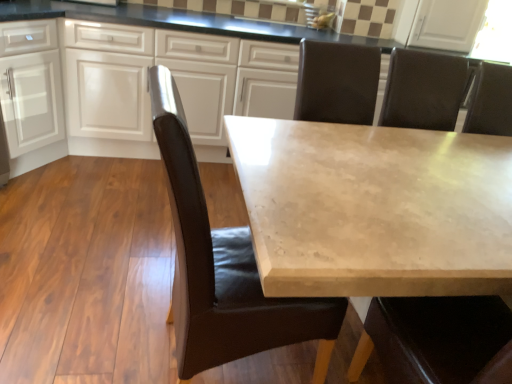
Question: From the image's perspective, is white matte cabinet at left, arranged as the 2th cabinetry when viewed from the right, on top of brown leather chair at center?

Choices:
 (A) no
 (B) yes

Answer: (B)

Question: Is white matte cabinet at left, the 1th cabinetry viewed from the left, further to the viewer compared to brown leather chair at center?

Choices:
 (A) yes
 (B) no

Answer: (A)

Question: Does white matte cabinet at left, arranged as the 2th cabinetry when viewed from the right, have a greater height compared to brown leather chair at center?

Choices:
 (A) no
 (B) yes

Answer: (A)

Question: From the image's perspective, is white matte cabinet at left, arranged as the 2th cabinetry when viewed from the right, located beneath brown leather chair at center?

Choices:
 (A) no
 (B) yes

Answer: (A)

Question: From a real-world perspective, is white matte cabinet at left, arranged as the 2th cabinetry when viewed from the right, physically above brown leather chair at center?

Choices:
 (A) yes
 (B) no

Answer: (B)

Question: Can you confirm if white matte cabinet at left, the 1th cabinetry viewed from the left, is positioned to the left of brown leather chair at center?

Choices:
 (A) yes
 (B) no

Answer: (A)

Question: From a real-world perspective, is white matte cabinet at left, the 1th cabinetry viewed from the left, positioned over beige marble table at center based on gravity?

Choices:
 (A) yes
 (B) no

Answer: (A)

Question: Is white matte cabinet at left, arranged as the 2th cabinetry when viewed from the right, facing towards beige marble table at center?

Choices:
 (A) no
 (B) yes

Answer: (B)

Question: Is the position of white matte cabinet at left, the 1th cabinetry viewed from the left, more distant than that of beige marble table at center?

Choices:
 (A) no
 (B) yes

Answer: (B)

Question: From a real-world perspective, is white matte cabinet at left, the 1th cabinetry viewed from the left, under beige marble table at center?

Choices:
 (A) yes
 (B) no

Answer: (B)

Question: Is the depth of white matte cabinet at left, the 1th cabinetry viewed from the left, less than that of beige marble table at center?

Choices:
 (A) no
 (B) yes

Answer: (A)

Question: Can you confirm if white matte cabinet at left, the 1th cabinetry viewed from the left, is shorter than beige marble table at center?

Choices:
 (A) no
 (B) yes

Answer: (A)

Question: From a real-world perspective, does white glossy cabinets at upper center, which is the 2th cabinetry in left-to-right order, sit lower than brown leather chair at center?

Choices:
 (A) no
 (B) yes

Answer: (B)